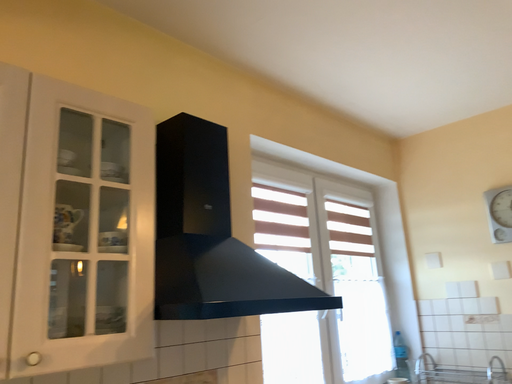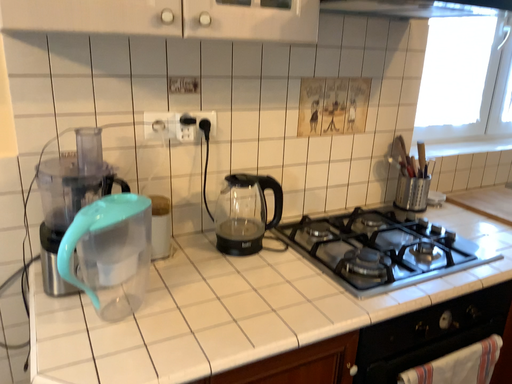
Question: Which way did the camera rotate in the video?

Choices:
 (A) rotated downward
 (B) rotated upward

Answer: (A)